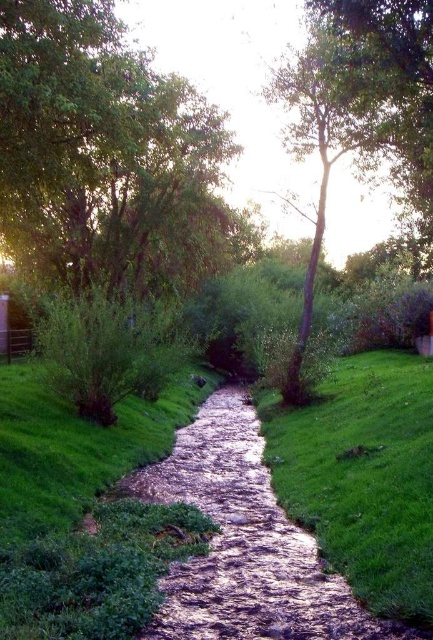
Question: Is green grassy bank at center below shiny metallic stream at center?

Choices:
 (A) no
 (B) yes

Answer: (A)

Question: Which of the following is the closest to the observer?

Choices:
 (A) (264, 477)
 (B) (409, 406)

Answer: (B)

Question: Is green grassy bank at center smaller than shiny metallic stream at center?

Choices:
 (A) yes
 (B) no

Answer: (B)

Question: Can you confirm if green grassy bank at center is positioned above shiny metallic stream at center?

Choices:
 (A) yes
 (B) no

Answer: (A)